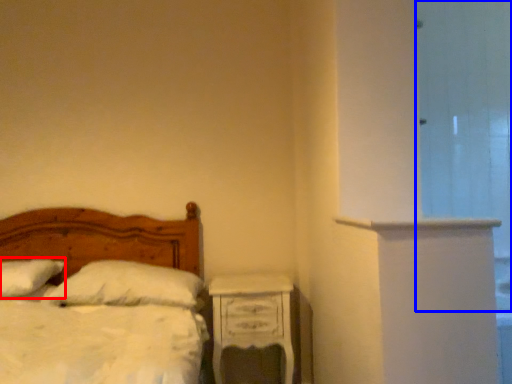
Question: Which of the following is the farthest to the observer, pillow (highlighted by a red box) or glass door (highlighted by a blue box)?

Choices:
 (A) pillow
 (B) glass door

Answer: (A)